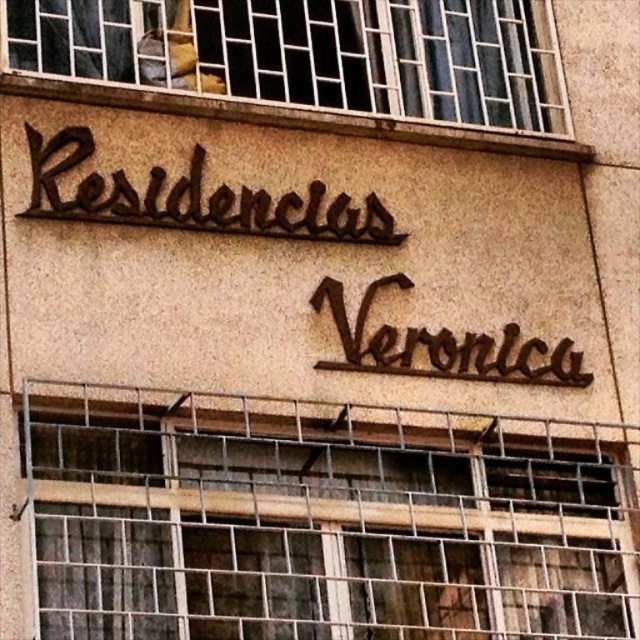
You are standing in front of the building with the sign Residencias Veronica. You need to locate the metallic grid at center. According to the coordinates provided, where exactly should you look?

You should look at point 0.809 on the x axis and 0.520 on the y axis to find the metallic grid at center.

You are standing in front of the building and want to know the relative positions of the metallic grid at center and metallic bars at upper center. Which one is located to the right of the other?

The metallic grid at center is to the right of metallic bars at upper center.

You are an architect assessing the structural integrity of the building. You notice the metallic grid at center and the metallic bars at upper center. Which of these two elements might pose a higher risk of corrosion due to their exposure to the environment?

The metallic grid at center is larger in size than metallic bars at upper center, so it has a greater surface area exposed to environmental elements, making it more susceptible to corrosion.